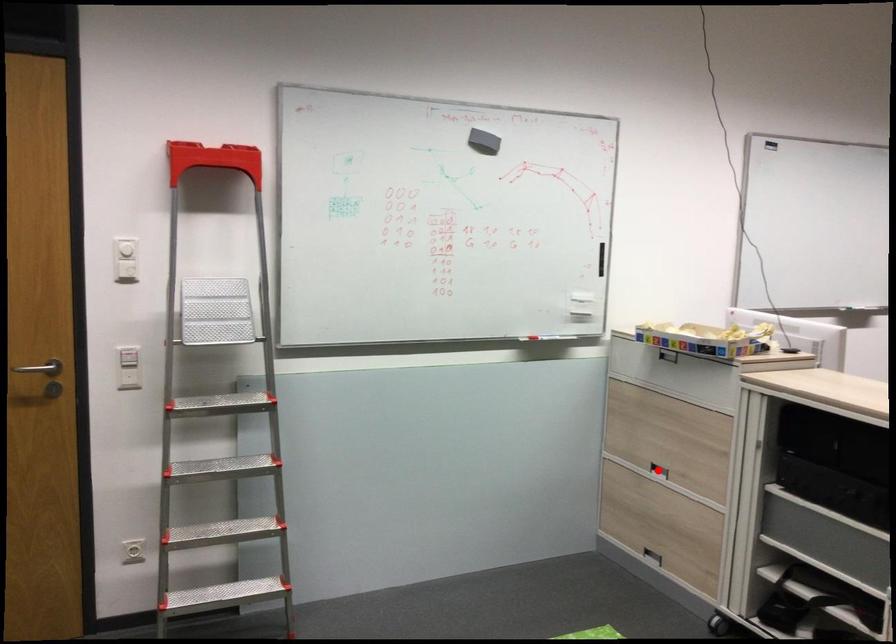
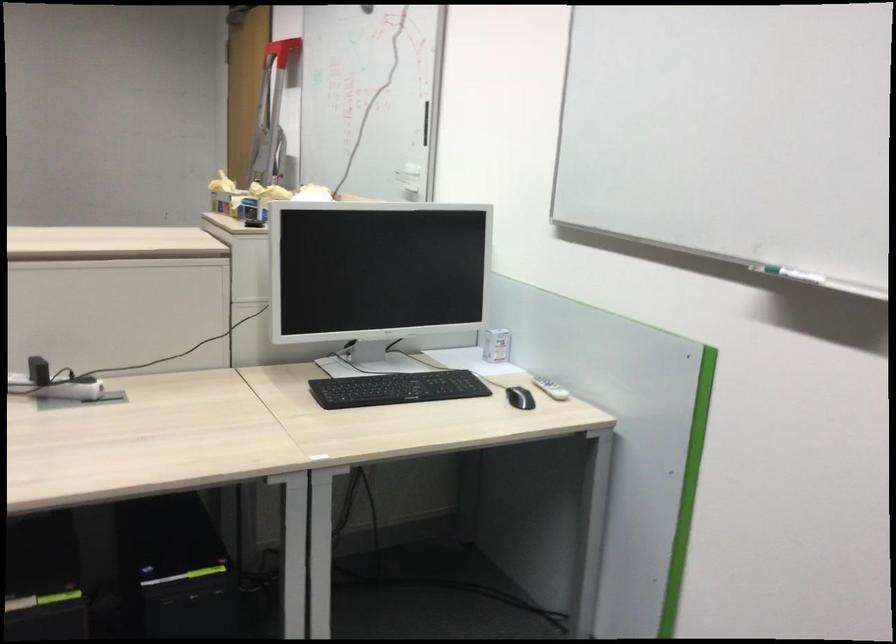
Question: I am providing you with two images of the same scene from different viewpoints. A red point is marked on the first image. At the location where the point appears in image 1, is it still visible in image 2?

Choices:
 (A) Yes
 (B) No

Answer: (B)